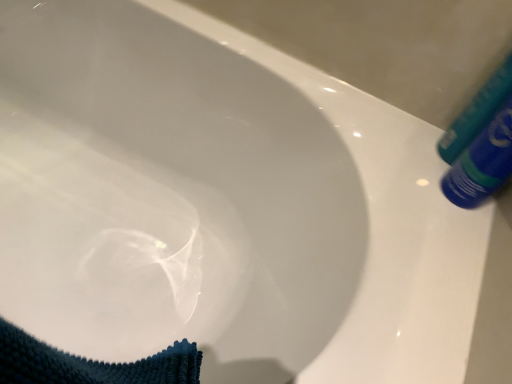
Question: Is point (460, 119) positioned closer to the camera than point (464, 195)?

Choices:
 (A) closer
 (B) farther

Answer: (B)

Question: From the image's perspective, is blue plastic tube at upper right, the 2th tube positioned from the bottom, located above or below blue glossy tube at upper right, acting as the 2th tube starting from the top?

Choices:
 (A) below
 (B) above

Answer: (B)

Question: In the image, is blue plastic tube at upper right, placed as the 1th tube when sorted from top to bottom, positioned in front of or behind blue glossy tube at upper right, which appears as the first tube when ordered from the bottom?

Choices:
 (A) front
 (B) behind

Answer: (B)

Question: Relative to blue plastic tube at upper right, the 2th tube positioned from the bottom, is blue glossy tube at upper right, which appears as the first tube when ordered from the bottom, in front or behind?

Choices:
 (A) behind
 (B) front

Answer: (B)

Question: In terms of height, does blue glossy tube at upper right, which appears as the first tube when ordered from the bottom, look taller or shorter compared to blue plastic tube at upper right, the 2th tube positioned from the bottom?

Choices:
 (A) tall
 (B) short

Answer: (B)

Question: Considering the positions of blue glossy tube at upper right, which appears as the first tube when ordered from the bottom, and blue plastic tube at upper right, placed as the 1th tube when sorted from top to bottom, in the image, is blue glossy tube at upper right, which appears as the first tube when ordered from the bottom, wider or thinner than blue plastic tube at upper right, placed as the 1th tube when sorted from top to bottom,?

Choices:
 (A) thin
 (B) wide

Answer: (B)

Question: Considering the positions of point (455, 200) and point (510, 91), is point (455, 200) closer or farther from the camera than point (510, 91)?

Choices:
 (A) closer
 (B) farther

Answer: (B)